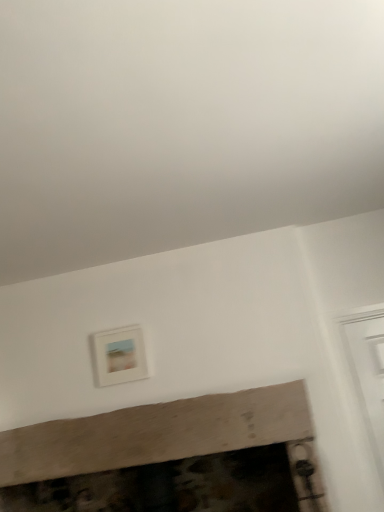
The width and height of the screenshot is (384, 512). Describe the element at coordinates (118, 356) in the screenshot. I see `matte white picture frame at upper center` at that location.

At what (x,y) coordinates should I click in order to perform the action: click on matte white picture frame at upper center. Please return your answer as a coordinate pair (x, y). This screenshot has width=384, height=512. Looking at the image, I should click on (118, 356).

What is the approximate width of matte white picture frame at upper center?

It is 8.11 centimeters.

Where is `matte white picture frame at upper center`? matte white picture frame at upper center is located at coordinates (118, 356).